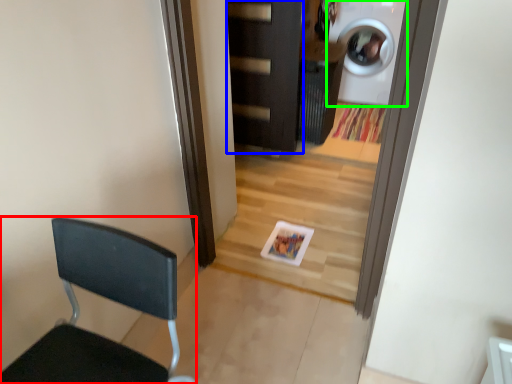
Question: Considering the real-world distances, which object is closest to chair (highlighted by a red box)? door (highlighted by a blue box) or washing machine (highlighted by a green box).

Choices:
 (A) door
 (B) washing machine

Answer: (A)